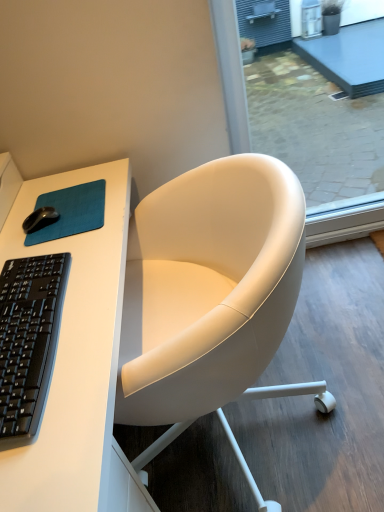
Question: Is transparent glass screen door at upper right facing away from black matte keyboard at left?

Choices:
 (A) no
 (B) yes

Answer: (A)

Question: Considering the relative positions of transparent glass screen door at upper right and black matte keyboard at left in the image provided, is transparent glass screen door at upper right to the left of black matte keyboard at left from the viewer's perspective?

Choices:
 (A) yes
 (B) no

Answer: (B)

Question: From a real-world perspective, does transparent glass screen door at upper right sit lower than black matte keyboard at left?

Choices:
 (A) yes
 (B) no

Answer: (A)

Question: Does transparent glass screen door at upper right have a greater width compared to black matte keyboard at left?

Choices:
 (A) yes
 (B) no

Answer: (B)

Question: From the image's perspective, is transparent glass screen door at upper right above black matte keyboard at left?

Choices:
 (A) no
 (B) yes

Answer: (B)

Question: Can you confirm if transparent glass screen door at upper right is smaller than black matte keyboard at left?

Choices:
 (A) no
 (B) yes

Answer: (A)

Question: Are black matte keyboard at left and transparent glass screen door at upper right located far from each other?

Choices:
 (A) yes
 (B) no

Answer: (B)

Question: Does black matte keyboard at left appear on the right side of transparent glass screen door at upper right?

Choices:
 (A) no
 (B) yes

Answer: (A)

Question: Does black matte keyboard at left have a larger size compared to transparent glass screen door at upper right?

Choices:
 (A) yes
 (B) no

Answer: (B)

Question: Is black matte keyboard at left oriented towards transparent glass screen door at upper right?

Choices:
 (A) no
 (B) yes

Answer: (A)

Question: Does black matte keyboard at left have a lesser width compared to transparent glass screen door at upper right?

Choices:
 (A) yes
 (B) no

Answer: (B)

Question: Can we say black matte keyboard at left lies outside transparent glass screen door at upper right?

Choices:
 (A) no
 (B) yes

Answer: (B)

Question: Is transparent glass screen door at upper right facing away from white leather chair at center?

Choices:
 (A) no
 (B) yes

Answer: (A)